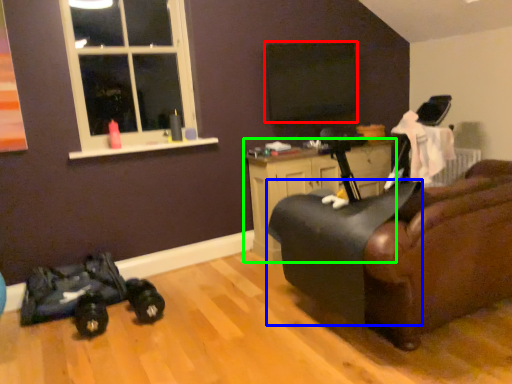
Question: Which object is the closest to the window screen (highlighted by a red box)? Choose among these: swivel chair (highlighted by a blue box) or cabinetry (highlighted by a green box).

Choices:
 (A) swivel chair
 (B) cabinetry

Answer: (B)